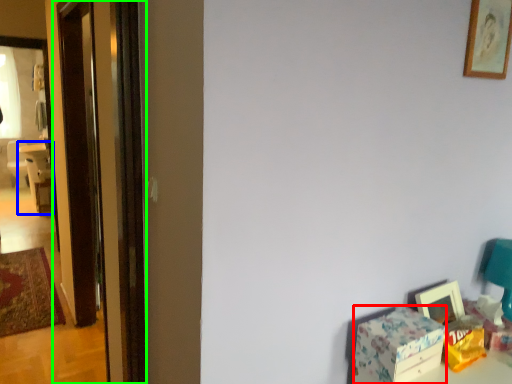
Question: Based on their relative distances, which object is farther from box (highlighted by a red box)? Choose from chair (highlighted by a blue box) and screen door (highlighted by a green box).

Choices:
 (A) chair
 (B) screen door

Answer: (A)